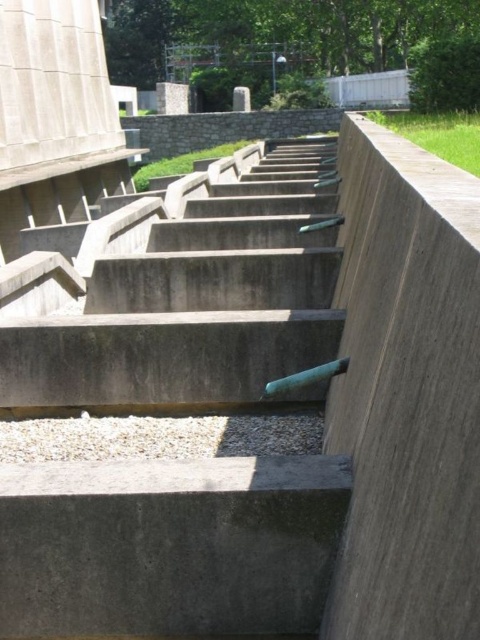
Does concrete stairs at center have a larger size compared to gray concrete at center?

Indeed, concrete stairs at center has a larger size compared to gray concrete at center.

Does point (265, 202) come closer to viewer compared to point (265, 536)?

No, (265, 202) is behind (265, 536).

The height and width of the screenshot is (640, 480). Find the location of `concrete stairs at center`. concrete stairs at center is located at coordinates (183, 292).